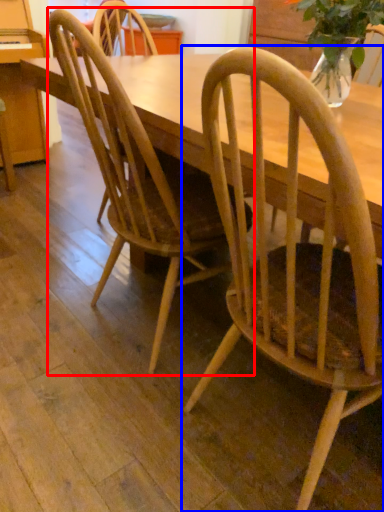
Question: Which object appears farthest to the camera in this image, chair (highlighted by a red box) or chair (highlighted by a blue box)?

Choices:
 (A) chair
 (B) chair

Answer: (A)